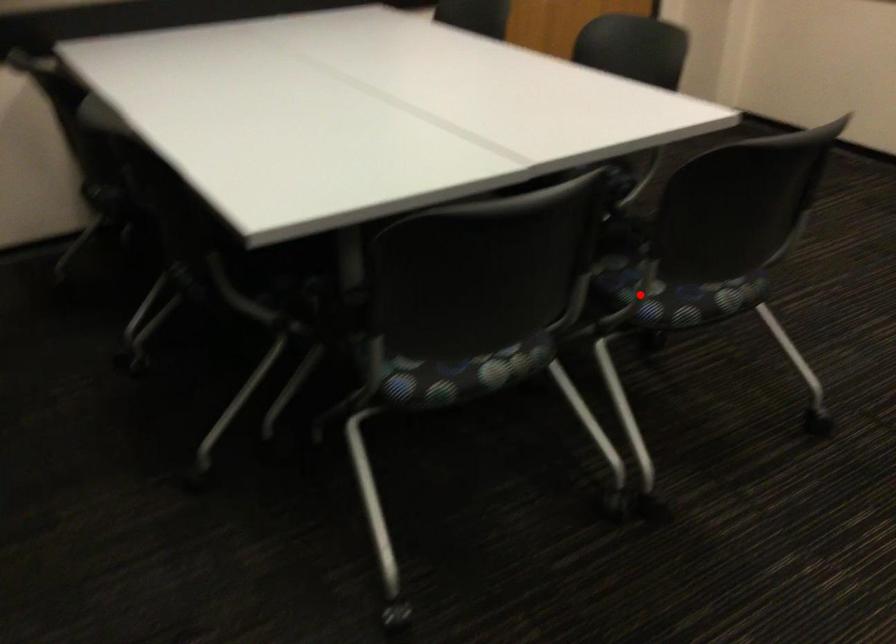
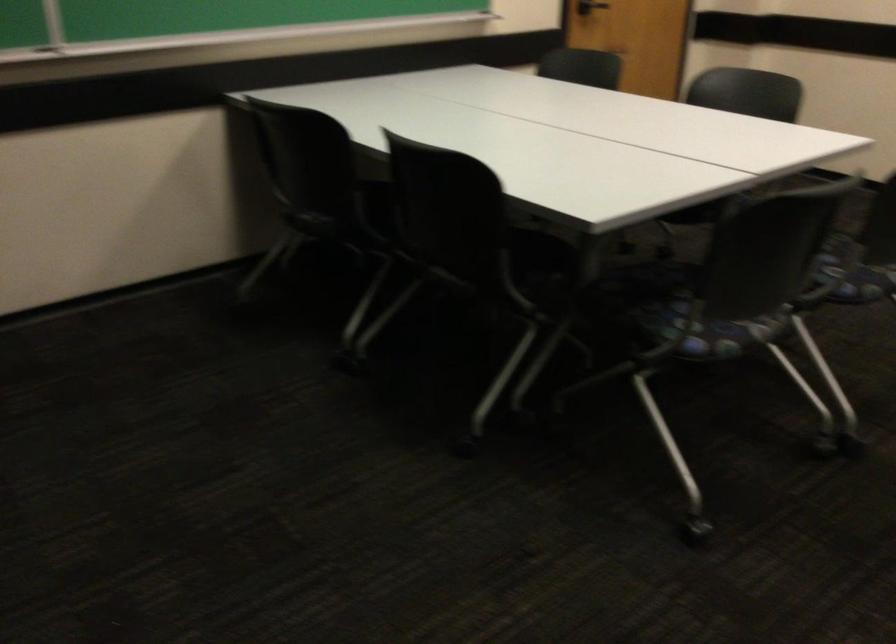
In the second image, find the point that corresponds to the highlighted location in the first image.

(853, 272)